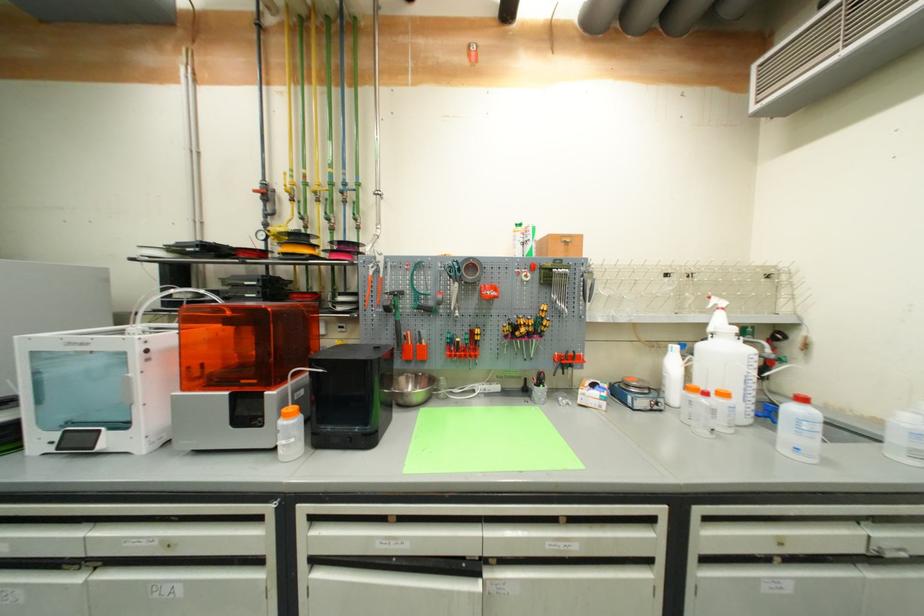
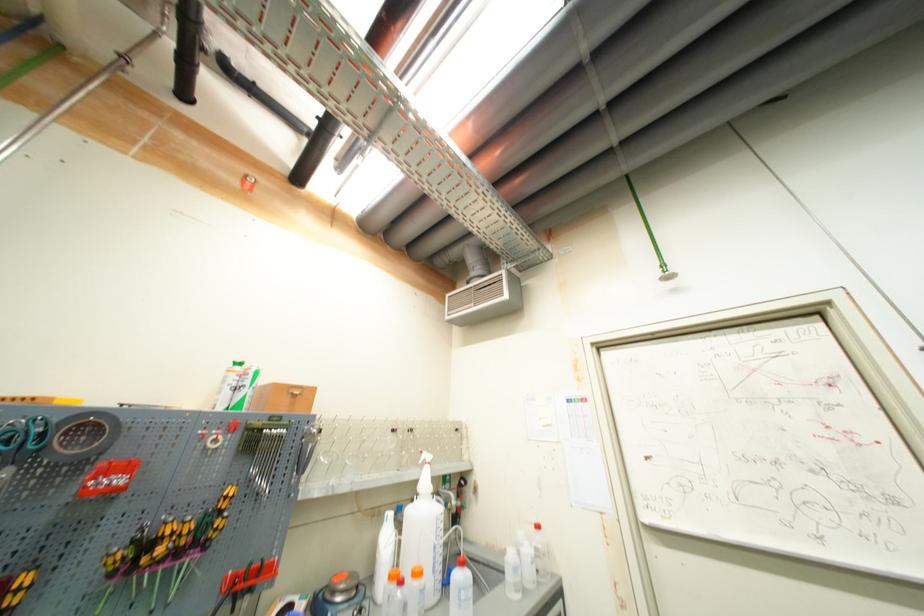
The point at (x=568, y=246) is marked in the first image. Where is the corresponding point in the second image?

(295, 398)